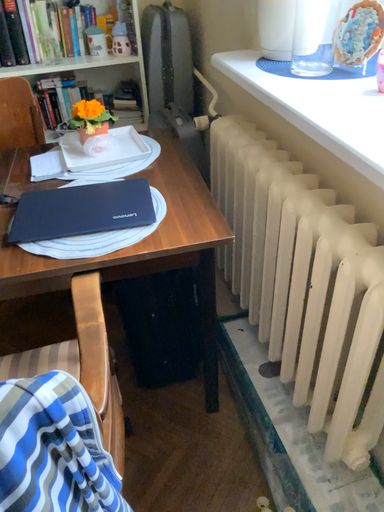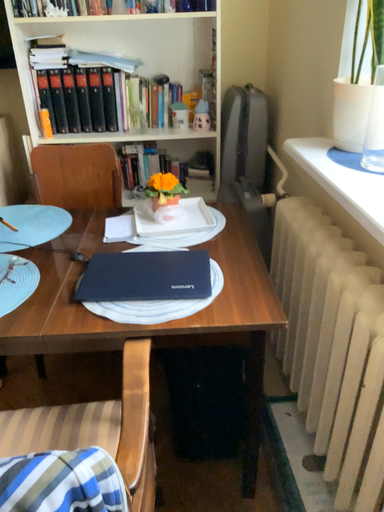
Question: Which way did the camera rotate in the video?

Choices:
 (A) rotated downward
 (B) rotated upward

Answer: (B)